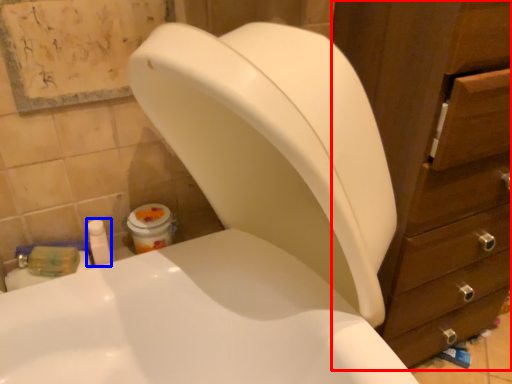
Question: Which object appears farthest to the camera in this image, cabinet (highlighted by a red box) or toiletry (highlighted by a blue box)?

Choices:
 (A) cabinet
 (B) toiletry

Answer: (B)